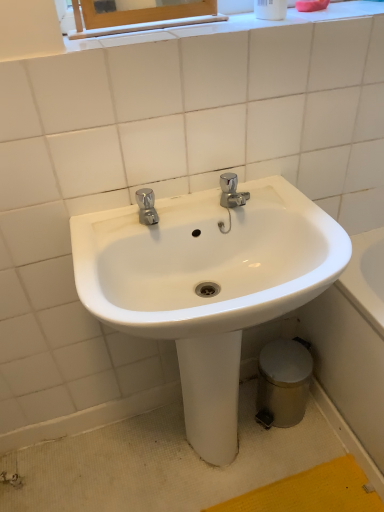
The height and width of the screenshot is (512, 384). Find the location of `free space on the front side of silver metallic trash can at lower right`. free space on the front side of silver metallic trash can at lower right is located at coordinates (289, 456).